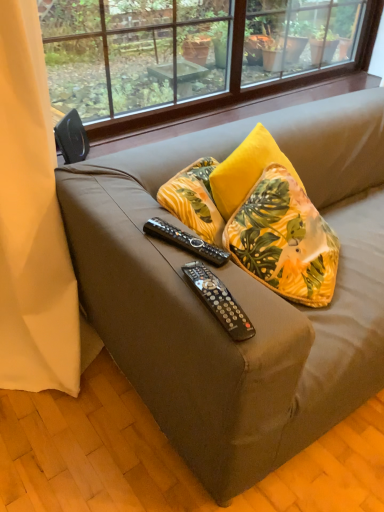
Question: Is black plastic remote control at center, which is the first remote control in top-to-bottom order, inside matte brown couch at center?

Choices:
 (A) yes
 (B) no

Answer: (A)

Question: Is matte brown couch at center placed right next to black plastic remote control at center, which is the 2th remote control from bottom to top?

Choices:
 (A) no
 (B) yes

Answer: (A)

Question: Can we say matte brown couch at center lies outside black plastic remote control at center, the 1th remote control in the back-to-front sequence?

Choices:
 (A) yes
 (B) no

Answer: (A)

Question: Does matte brown couch at center have a greater height compared to black plastic remote control at center, which is the first remote control in top-to-bottom order?

Choices:
 (A) no
 (B) yes

Answer: (B)

Question: Can you confirm if matte brown couch at center is positioned to the left of black plastic remote control at center, the 1th remote control in the back-to-front sequence?

Choices:
 (A) yes
 (B) no

Answer: (B)

Question: Is matte brown couch at center taller or shorter than yellow fabric pillow at upper right?

Choices:
 (A) tall
 (B) short

Answer: (A)

Question: Visually, is matte brown couch at center positioned to the left or to the right of yellow fabric pillow at upper right?

Choices:
 (A) left
 (B) right

Answer: (B)

Question: Based on their sizes in the image, would you say matte brown couch at center is bigger or smaller than yellow fabric pillow at upper right?

Choices:
 (A) small
 (B) big

Answer: (B)

Question: Does point (319, 148) appear closer or farther from the camera than point (327, 249)?

Choices:
 (A) closer
 (B) farther

Answer: (B)

Question: Considering the positions of beige fabric curtain at left and matte brown couch at center in the image, is beige fabric curtain at left wider or thinner than matte brown couch at center?

Choices:
 (A) thin
 (B) wide

Answer: (A)

Question: In terms of size, does beige fabric curtain at left appear bigger or smaller than matte brown couch at center?

Choices:
 (A) small
 (B) big

Answer: (A)

Question: From a real-world perspective, is beige fabric curtain at left above or below matte brown couch at center?

Choices:
 (A) below
 (B) above

Answer: (B)

Question: Relative to matte brown couch at center, is beige fabric curtain at left in front or behind?

Choices:
 (A) front
 (B) behind

Answer: (A)

Question: Do you think matte brown couch at center is within beige fabric curtain at left, or outside of it?

Choices:
 (A) inside
 (B) outside

Answer: (B)

Question: Considering their positions, is matte brown couch at center located in front of or behind beige fabric curtain at left?

Choices:
 (A) behind
 (B) front

Answer: (A)